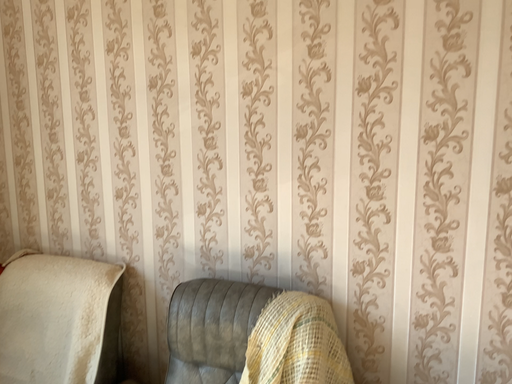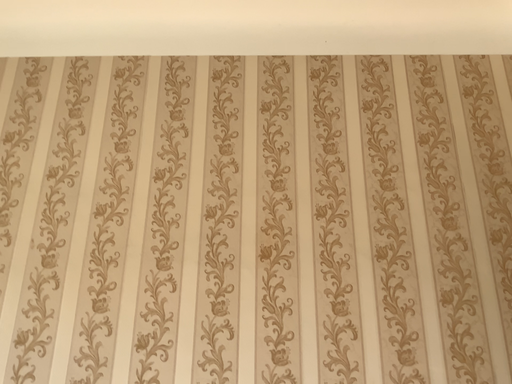
Question: Which way did the camera rotate in the video?

Choices:
 (A) rotated upward
 (B) rotated downward

Answer: (A)